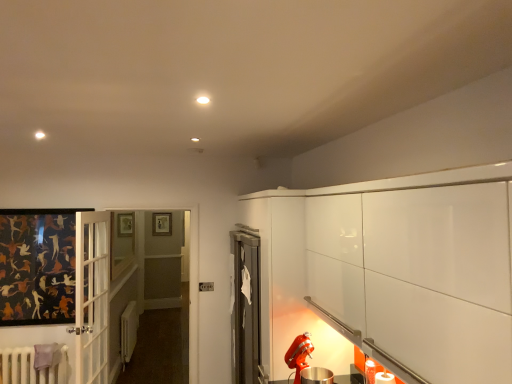
At what (x,y) coordinates should I click in order to perform the action: click on blank space above white painted radiator at lower left, the 2th radiator from the back (from a real-world perspective). Please return your answer as a coordinate pair (x, y). The image size is (512, 384). Looking at the image, I should click on (42, 346).